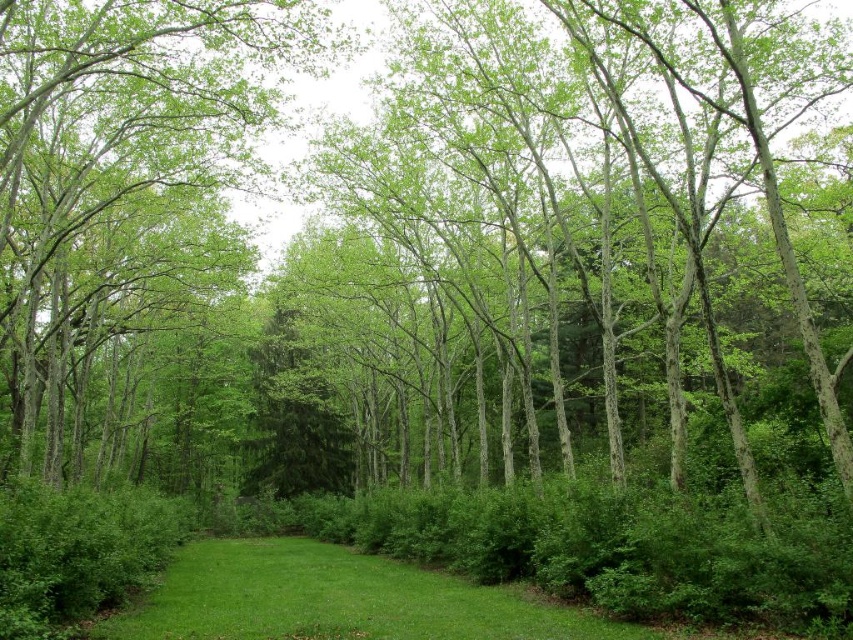
You are standing at the point closest to you in the forest scene. There are two points marked in the image, one at coordinates point [228,81] and another at point [300,602]. Which point is farther away from your current position?

Point [228,81] is behind point [300,602], so the point farther away from your current position is point [228,81].

You are standing in the forest and see the green leafy tree at center and the green grass at center. Which one is higher from the ground?

The green leafy tree at center is above the green grass at center, so the green leafy tree at center is higher from the ground.